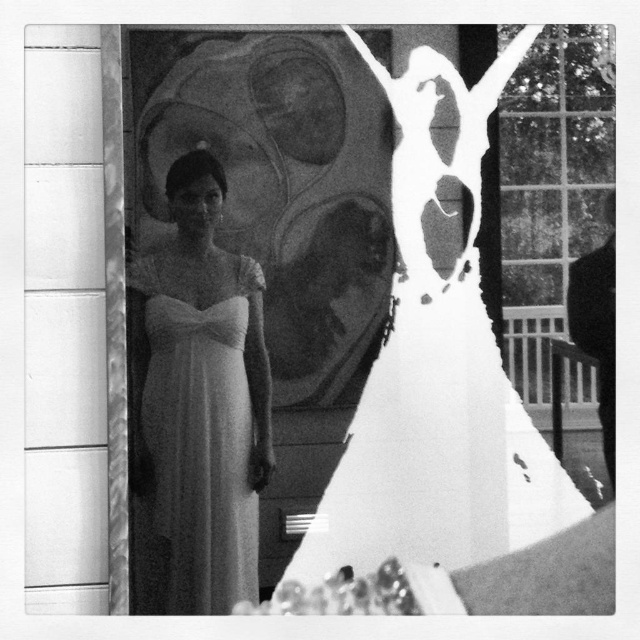
Question: Can you confirm if satin white dress at center is positioned above matte white dress at center?

Choices:
 (A) yes
 (B) no

Answer: (B)

Question: Among these points, which one is nearest to the camera?

Choices:
 (A) (582, 321)
 (B) (186, 468)

Answer: (B)

Question: Based on their relative distances, which object is farther from the transparent glass mirror at upper center?

Choices:
 (A) matte white dress at center
 (B) satin white dress at center

Answer: (B)

Question: Is satin white dress at center smaller than black matte suit at right?

Choices:
 (A) no
 (B) yes

Answer: (A)

Question: Which of the following is the farthest from the observer?

Choices:
 (A) satin white dress at center
 (B) transparent glass mirror at upper center

Answer: (A)

Question: Can you confirm if satin white dress at center is positioned above black matte suit at right?

Choices:
 (A) yes
 (B) no

Answer: (B)